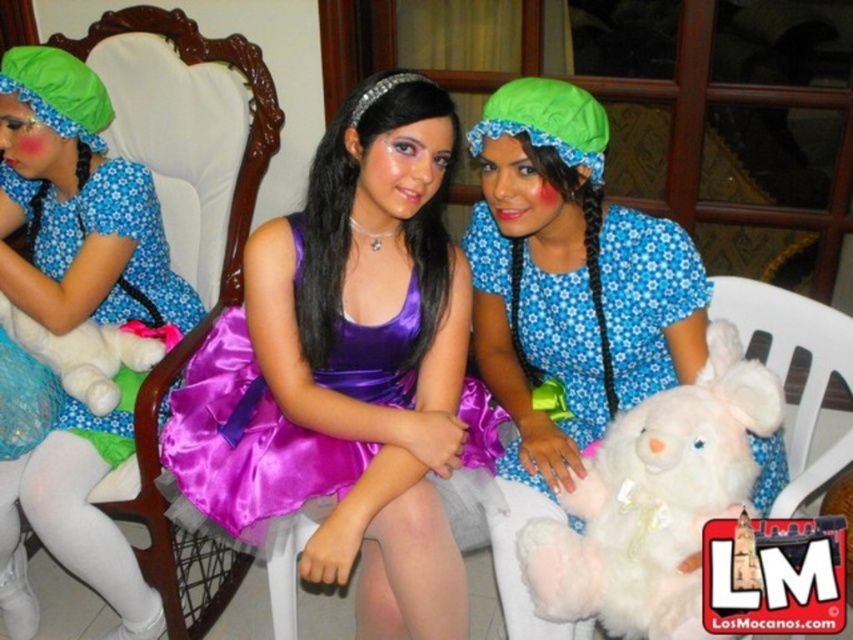
Does point (643, 324) come in front of point (67, 420)?

That is True.

Is point (761, 444) positioned behind point (50, 326)?

No, it is not.

The height and width of the screenshot is (640, 853). Describe the element at coordinates (566, 307) in the screenshot. I see `matte blue dress at center` at that location.

The height and width of the screenshot is (640, 853). Identify the location of matte blue dress at center. (566, 307).

Is point (50, 544) behind point (677, 572)?

Yes, point (50, 544) is behind point (677, 572).

Which is below, matte blue dress at left or white plush bear at center?

white plush bear at center

The width and height of the screenshot is (853, 640). Find the location of `matte blue dress at left`. matte blue dress at left is located at coordinates [x=78, y=204].

In the scene shown: Between purple satin dress at center and matte blue dress at center, which one is positioned higher?

Positioned higher is matte blue dress at center.

Which is below, purple satin dress at center or matte blue dress at center?

Positioned lower is purple satin dress at center.

What are the coordinates of `purple satin dress at center` in the screenshot? It's located at (347, 369).